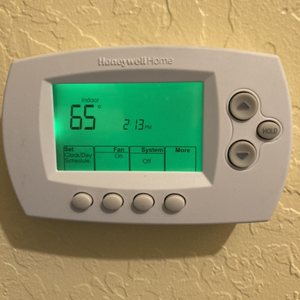
Identify the location of shadow of smart thermostat. Image resolution: width=300 pixels, height=300 pixels. (99, 249).